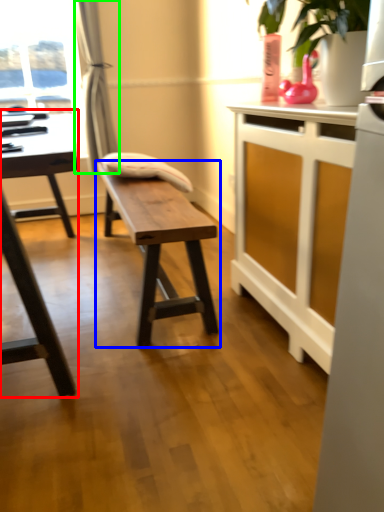
Question: Which is nearer to the table (highlighted by a red box)? table (highlighted by a blue box) or curtain (highlighted by a green box).

Choices:
 (A) table
 (B) curtain

Answer: (A)